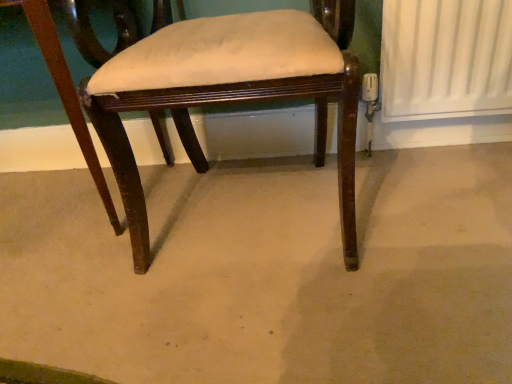
The image size is (512, 384). Find the location of `vacant space underneath mahogany wood chair at center (from a real-world perspective)`. vacant space underneath mahogany wood chair at center (from a real-world perspective) is located at coordinates (249, 203).